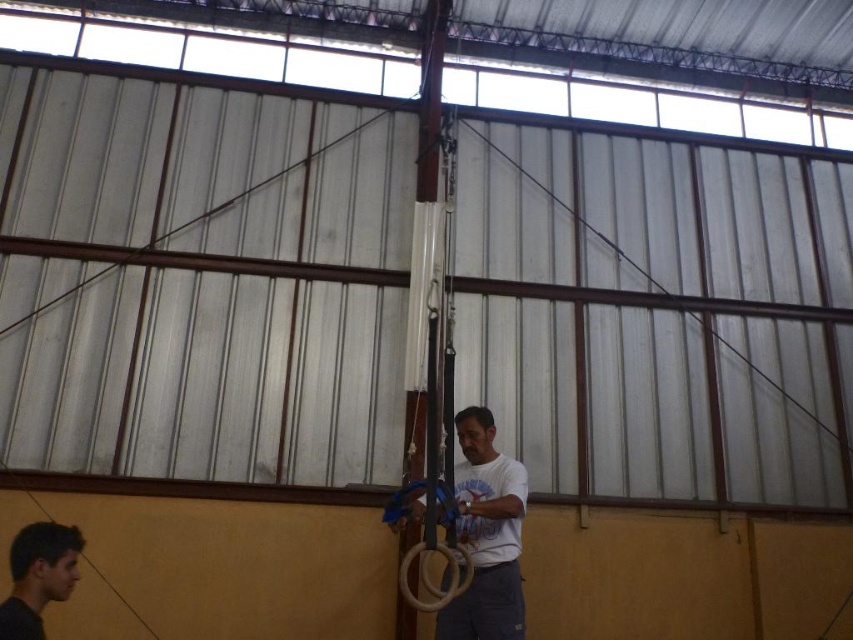
You are an observer in the gymnasium. You notice the white matte gymnastic rings at center and the smooth skin face at lower left. Which object is positioned to the right of the other?

The white matte gymnastic rings at center is to the right of smooth skin face at lower left.

You are standing in the gymnasium and want to locate the white glossy pole at center. Based on the coordinates provided, which part of the room should you look towards?

The white glossy pole at center is located at coordinates point (426, 257), so you should look towards the center area of the room.